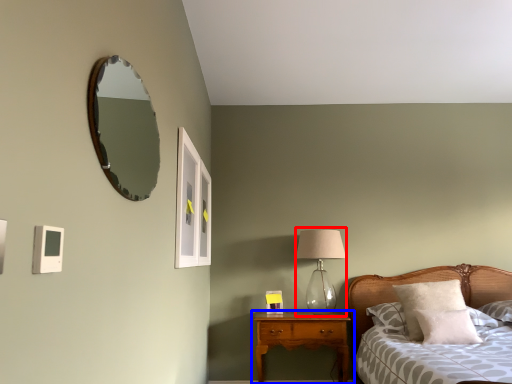
Question: Among these objects, which one is farthest to the camera, table lamp (highlighted by a red box) or nightstand (highlighted by a blue box)?

Choices:
 (A) table lamp
 (B) nightstand

Answer: (A)